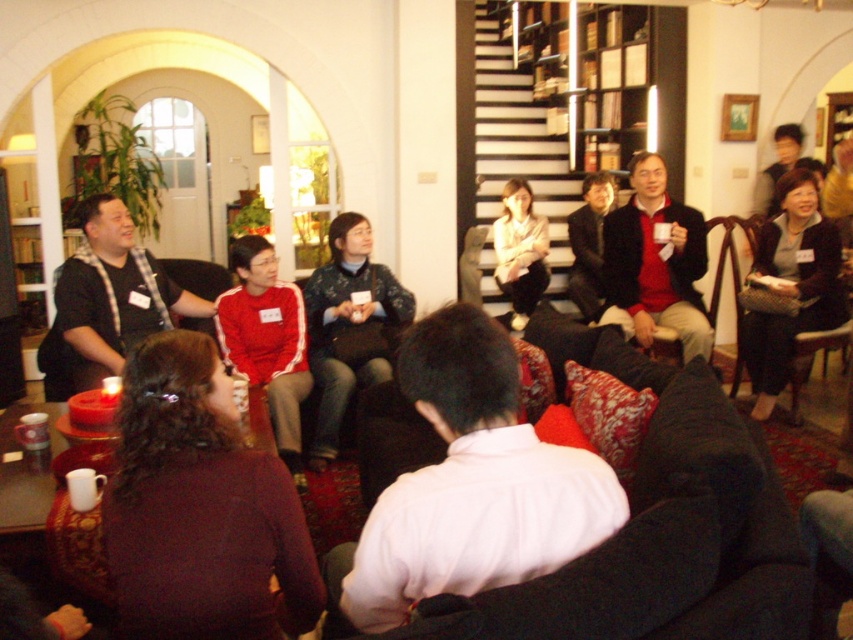
You are organizing a clothing donation drive and need to determine which items can fit into a standard donation box. The dark blue textured sweater at center and the red fabric jacket at center are both items to consider. Based on their sizes, which one is more likely to fit into the box?

The red fabric jacket at center is more likely to fit into the standard donation box since it is smaller in size compared to the dark blue textured sweater at center.

You are a photographer trying to capture a candid shot of the two individuals wearing the dark blue textured sweater at center and the red fabric jacket at center. To ensure both are in focus without moving the camera, what is the minimum distance you should set the depth of field? The objects description says they are 10.03 inches apart. The answer should be the distance between them plus a safety margin of 2 inches. Calculate the required depth of field in inches.

The minimum depth of field required would be 12.03 inches, calculated by adding the 10.03 inches distance between the dark blue textured sweater at center and the red fabric jacket at center plus a 2 inch safety margin.